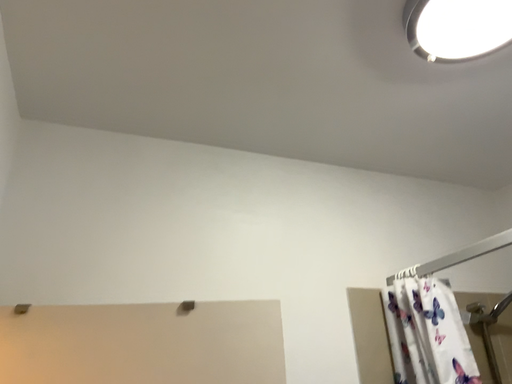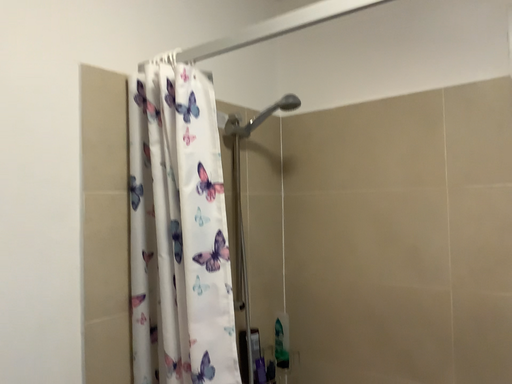
Question: How did the camera likely rotate when shooting the video?

Choices:
 (A) rotated downward
 (B) rotated upward

Answer: (A)